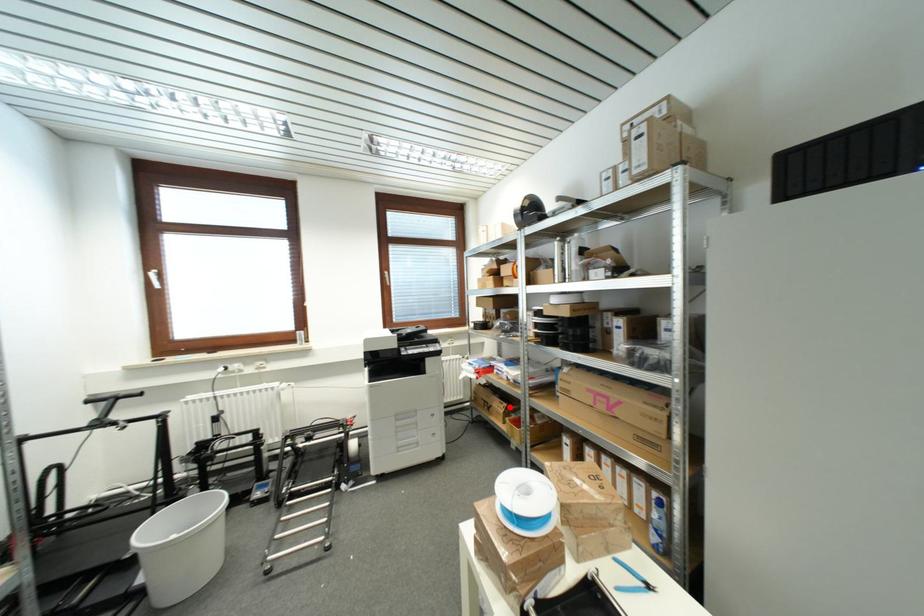
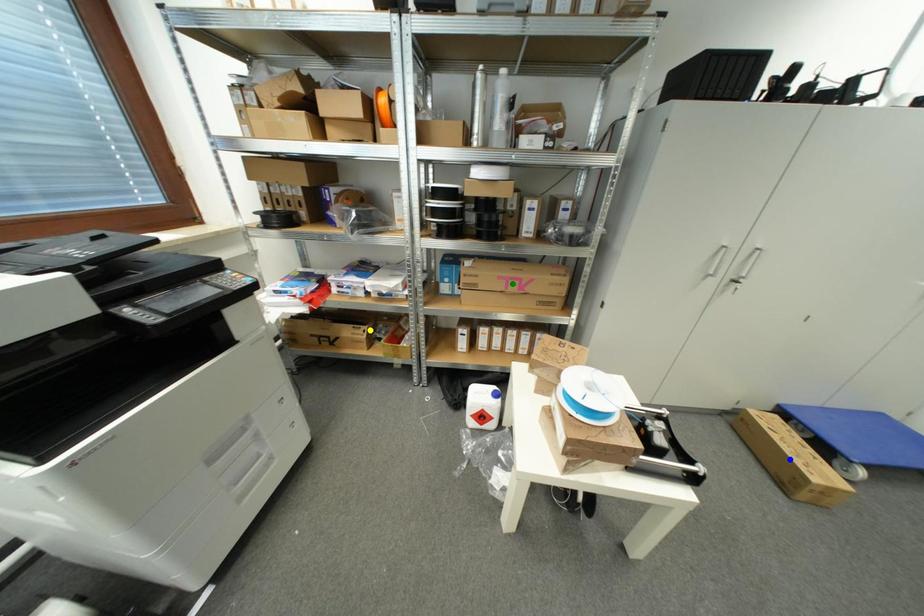
Question: I am providing you with two images of the same scene from different viewpoints. A red point is marked on the first image. You are given multiple points on the second image. Which point in image 2 represents the same 3d spot as the red point in image 1?

Choices:
 (A) yellow point
 (B) blue point
 (C) green point

Answer: (A)